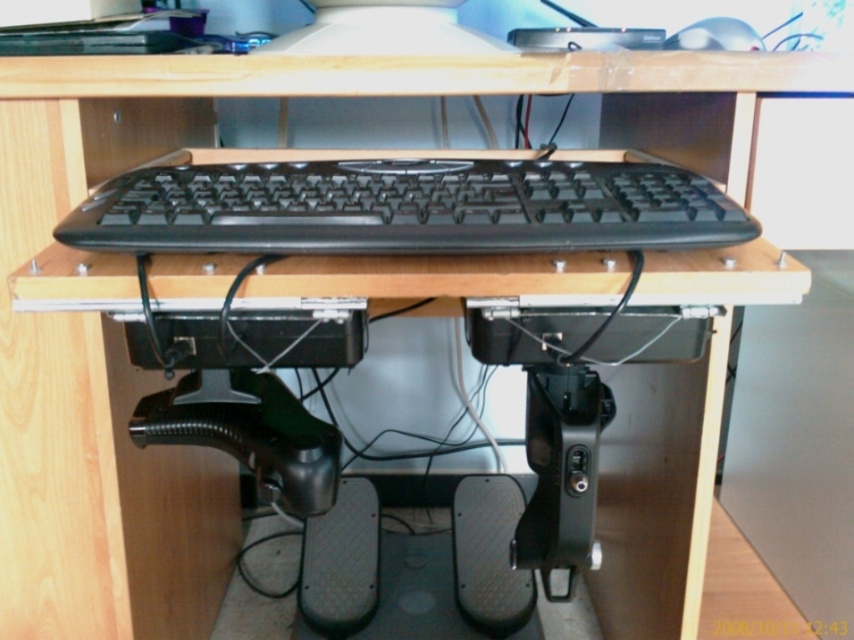
Question: In this image, where is black matte keyboard at center located relative to silver metallic mouse at upper right?

Choices:
 (A) right
 (B) left

Answer: (B)

Question: Is black matte keyboard at center positioned at the back of silver metallic mouse at upper right?

Choices:
 (A) no
 (B) yes

Answer: (A)

Question: Which object is positioned farthest from the black matte keyboard at center?

Choices:
 (A) silver metallic mouse at upper right
 (B) matte black monitor at upper center

Answer: (A)

Question: Which of the following is the closest to the observer?

Choices:
 (A) (733, 22)
 (B) (313, 29)

Answer: (B)

Question: Considering the real-world distances, which object is farthest from the black matte keyboard at center?

Choices:
 (A) matte black monitor at upper center
 (B) silver metallic mouse at upper right

Answer: (B)

Question: Is black matte keyboard at center further to the viewer compared to silver metallic mouse at upper right?

Choices:
 (A) no
 (B) yes

Answer: (A)